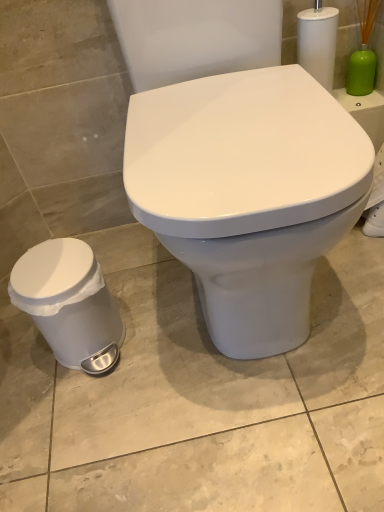
Identify the location of vacant space in front of white plastic trash can at lower left. This screenshot has height=512, width=384. (85, 420).